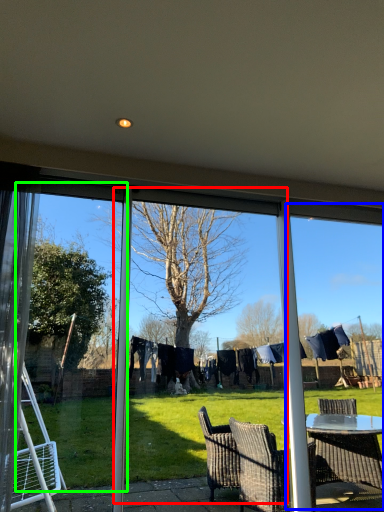
Question: Which is nearer to the screen door (highlighted by a red box)? window frame (highlighted by a blue box) or screen door (highlighted by a green box).

Choices:
 (A) window frame
 (B) screen door

Answer: (B)